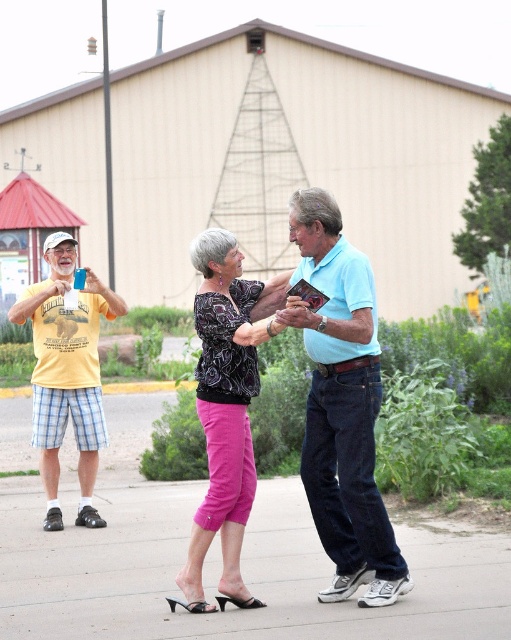
Who is more forward, (187, 509) or (196, 250)?

Point (196, 250) is more forward.

Which of these two, pink fabric pants at lower center or patterned fabric blouse at center, stands shorter?

With less height is pink fabric pants at lower center.

Does point (276, 554) lie behind point (250, 506)?

Yes.

The width and height of the screenshot is (511, 640). Find the location of `pink fabric pants at lower center`. pink fabric pants at lower center is located at coordinates (242, 570).

Does pink fabric pants at lower center lie behind light blue cotton shirt at center?

Yes, pink fabric pants at lower center is behind light blue cotton shirt at center.

Is pink fabric pants at lower center to the left of light blue cotton shirt at center from the viewer's perspective?

Correct, you'll find pink fabric pants at lower center to the left of light blue cotton shirt at center.

At what (x,y) coordinates should I click in order to perform the action: click on pink fabric pants at lower center. Please return your answer as a coordinate pair (x, y). Looking at the image, I should click on (242, 570).

The image size is (511, 640). What do you see at coordinates (226, 406) in the screenshot?
I see `patterned fabric blouse at center` at bounding box center [226, 406].

Between patterned fabric blouse at center and yellow cotton t-shirt at left, which one has less height?

patterned fabric blouse at center is shorter.

The height and width of the screenshot is (640, 511). Find the location of `patterned fabric blouse at center`. patterned fabric blouse at center is located at coordinates (226, 406).

Locate an element on the screen. This screenshot has width=511, height=640. patterned fabric blouse at center is located at coordinates (226, 406).